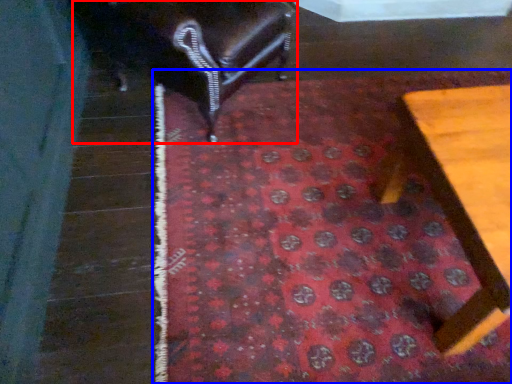
Question: Which point is further to the camera, furniture (highlighted by a red box) or mat (highlighted by a blue box)?

Choices:
 (A) furniture
 (B) mat

Answer: (A)